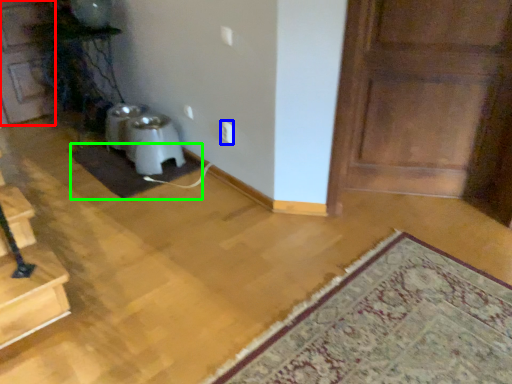
Question: Based on their relative distances, which object is farther from door (highlighted by a red box)? Choose from electric outlet (highlighted by a blue box) and doormat (highlighted by a green box).

Choices:
 (A) electric outlet
 (B) doormat

Answer: (A)